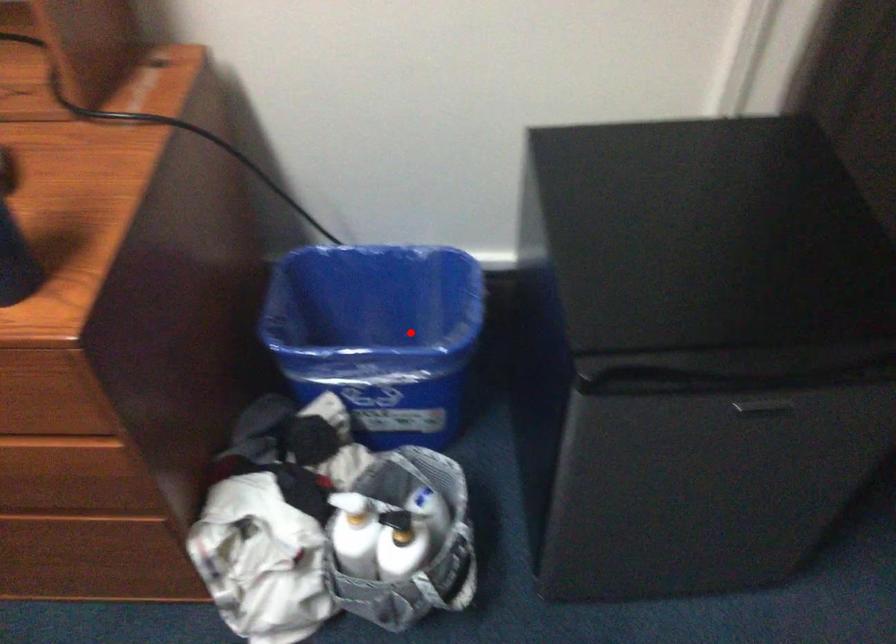
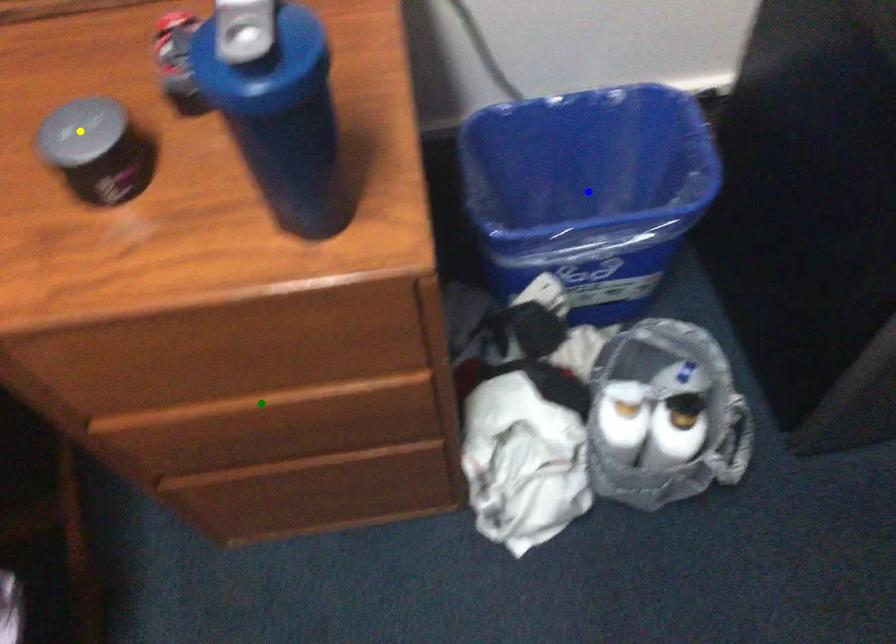
Question: I am providing you with two images of the same scene from different viewpoints. A red point is marked on the first image. You are given multiple points on the second image. Which mark in image 2 goes with the point in image 1?

Choices:
 (A) green point
 (B) blue point
 (C) yellow point

Answer: (B)